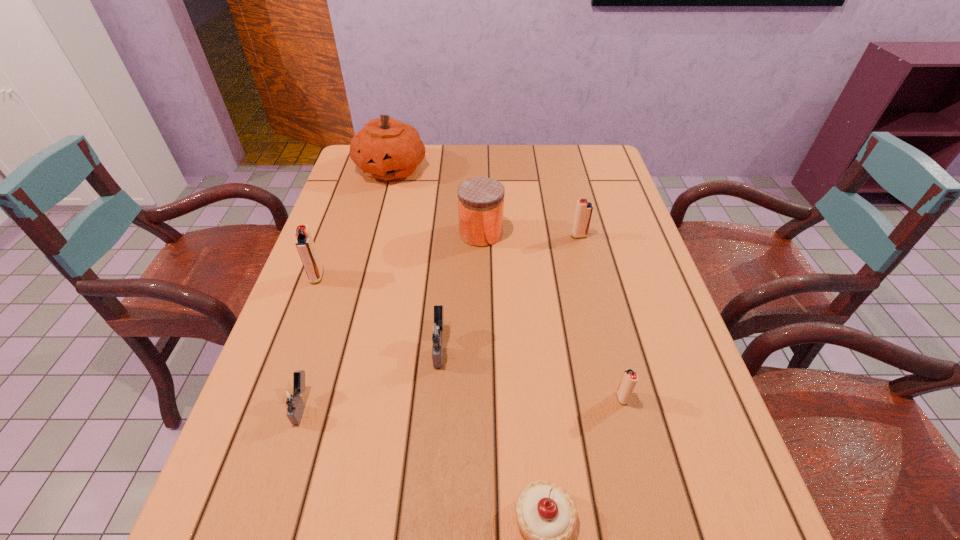
Find the location of a particular element. the farthest object is located at coordinates (387, 149).

Find the location of a particular element. This screenshot has height=540, width=960. pumpkin is located at coordinates (387, 149).

The height and width of the screenshot is (540, 960). I want to click on the fourth farthest object, so click(304, 242).

Identify the location of the second farthest red igniter. The image size is (960, 540). (304, 242).

Locate an element on the screen. orange jar is located at coordinates (481, 199).

I want to click on the third farthest igniter, so click(438, 331).

This screenshot has height=540, width=960. Identify the location of the right gray igniter. (438, 331).

The width and height of the screenshot is (960, 540). I want to click on the second biggest red igniter, so click(584, 209).

The width and height of the screenshot is (960, 540). I want to click on the farthest igniter, so click(x=584, y=209).

Locate an element on the screen. This screenshot has width=960, height=540. the nearest red igniter is located at coordinates (630, 378).